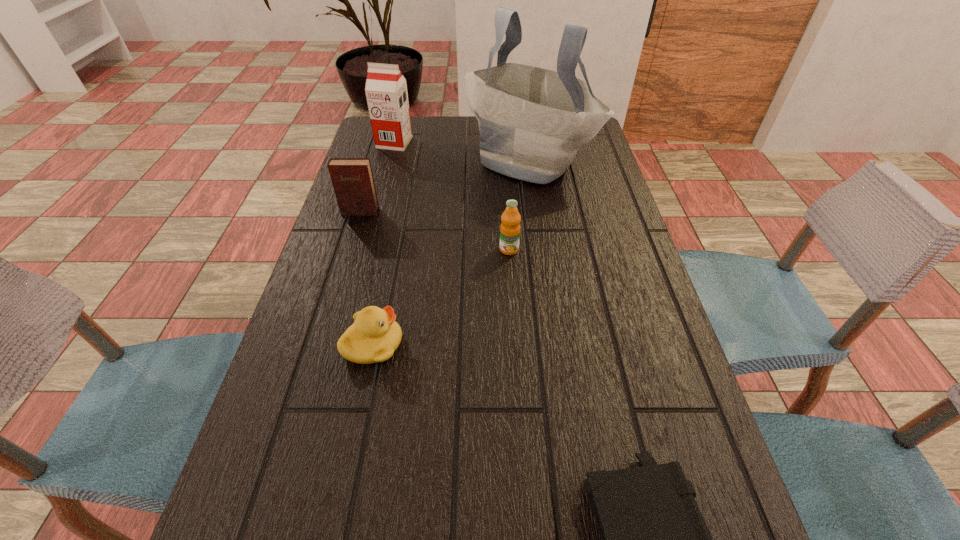
Locate an element on the screen. Image resolution: width=960 pixels, height=540 pixels. vacant space located on the beak of the second shortest object is located at coordinates (455, 345).

Where is `shopping bag that is at the far edge`? The width and height of the screenshot is (960, 540). shopping bag that is at the far edge is located at coordinates (532, 121).

Where is `soya milk that is positioned at the far edge`? The width and height of the screenshot is (960, 540). soya milk that is positioned at the far edge is located at coordinates (386, 92).

Find the location of `soya milk located in the left edge section of the desktop`. soya milk located in the left edge section of the desktop is located at coordinates (386, 92).

In order to click on diary that is at the left edge in this screenshot , I will do `click(352, 178)`.

This screenshot has width=960, height=540. Identify the location of duckling that is at the left edge. (375, 335).

Find the location of a particular element. object that is positioned at the right edge is located at coordinates (532, 121).

Identify the location of object located at the far left corner. (386, 92).

Where is `object present at the far right corner`? object present at the far right corner is located at coordinates (532, 121).

What are the coordinates of `free location at the far edge of the desktop` in the screenshot? It's located at point(460,134).